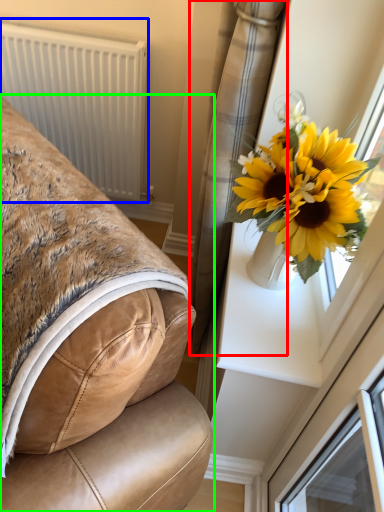
Question: Which is nearer to the curtain (highlighted by a red box)? radiator (highlighted by a blue box) or furniture (highlighted by a green box).

Choices:
 (A) radiator
 (B) furniture

Answer: (B)